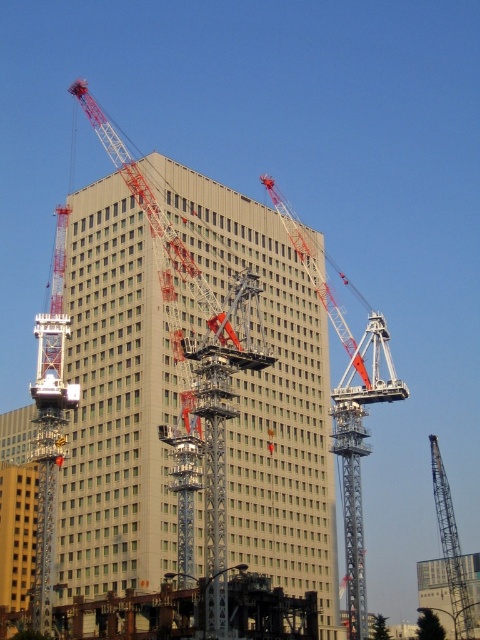
Question: Which point is farther to the camera?

Choices:
 (A) metallic gray crane at center
 (B) metallic red crane at center

Answer: (A)

Question: Among these points, which one is nearest to the camera?

Choices:
 (A) tap(312, 266)
 (B) tap(445, 566)
 (C) tap(435, 600)
 (D) tap(120, 269)

Answer: (D)

Question: Does metallic red crane at center appear under metallic gray crane at center?

Choices:
 (A) no
 (B) yes

Answer: (A)

Question: Which object appears farthest from the camera in this image?

Choices:
 (A) metallic gray crane at center
 (B) metallic gray crane at right
 (C) gray concrete building at center

Answer: (A)

Question: Does gray concrete building at center appear on the right side of metallic gray crane at right?

Choices:
 (A) no
 (B) yes

Answer: (A)

Question: Is gray concrete building at center in front of metallic gray crane at center?

Choices:
 (A) yes
 (B) no

Answer: (A)